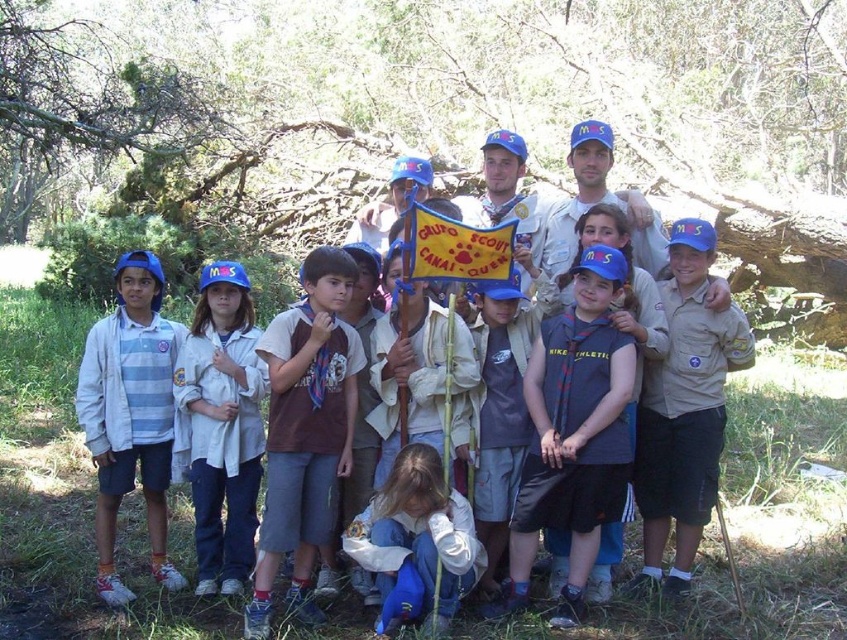
Consider the image. You are organizing a group photo for scouts and need to ensure there is enough space between the striped cotton shirt at left and the white matte shirt at center. The minimum required distance between scouts for the photo is 2 feet. Based on the image, is the current distance sufficient?

The striped cotton shirt at left is 18.61 inches from the white matte shirt at center. Since 18.61 inches is less than 24 inches, the distance is insufficient to meet the 2 feet requirement.

Please look at the image and locate the point at coordinates (222, 426). What object is positioned at this point?

The point at coordinates (222, 426) corresponds to the white matte shirt at center.

You are organizing a uniform inventory and notice two scouts in the image. One is wearing a striped cotton shirt at left, and the other has a white matte shirt at center. Which scout has a wider shirt?

The striped cotton shirt at left has a greater width compared to the white matte shirt at center, so the scout wearing the striped cotton shirt at left has a wider shirt.